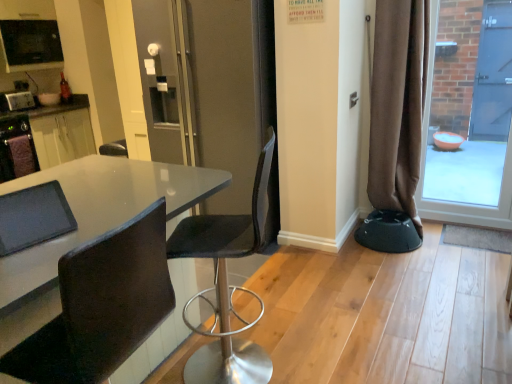
Question: Can you confirm if glossy white table at center is bigger than black plastic bar stool at lower right?

Choices:
 (A) yes
 (B) no

Answer: (A)

Question: Can you confirm if glossy white table at center is thinner than black plastic bar stool at lower right?

Choices:
 (A) yes
 (B) no

Answer: (B)

Question: Does glossy white table at center come behind black plastic bar stool at lower right?

Choices:
 (A) no
 (B) yes

Answer: (A)

Question: Is glossy white table at center smaller than black plastic bar stool at lower right?

Choices:
 (A) yes
 (B) no

Answer: (B)

Question: Can you confirm if glossy white table at center is shorter than black plastic bar stool at lower right?

Choices:
 (A) no
 (B) yes

Answer: (A)

Question: Does point (430, 213) appear closer or farther from the camera than point (203, 198)?

Choices:
 (A) farther
 (B) closer

Answer: (A)

Question: From the image's perspective, relative to glossy white table at center, is transparent glass door at right above or below?

Choices:
 (A) above
 (B) below

Answer: (A)

Question: From a real-world perspective, relative to glossy white table at center, is transparent glass door at right vertically above or below?

Choices:
 (A) below
 (B) above

Answer: (B)

Question: Is transparent glass door at right to the left or to the right of glossy white table at center in the image?

Choices:
 (A) left
 (B) right

Answer: (B)

Question: Considering the positions of black leather chair at lower left, arranged as the first chair when viewed from the front, and matte black table at left in the image, is black leather chair at lower left, arranged as the first chair when viewed from the front, wider or thinner than matte black table at left?

Choices:
 (A) wide
 (B) thin

Answer: (B)

Question: Is point (31, 362) positioned closer to the camera than point (22, 173)?

Choices:
 (A) farther
 (B) closer

Answer: (B)

Question: In the image, is black leather chair at lower left, the second chair viewed from the back, on the left side or the right side of matte black table at left?

Choices:
 (A) left
 (B) right

Answer: (B)

Question: In terms of height, does black leather chair at lower left, arranged as the first chair when viewed from the front, look taller or shorter compared to matte black table at left?

Choices:
 (A) short
 (B) tall

Answer: (B)

Question: Considering their positions, is matte black table at left located in front of or behind brushed metal toaster at left, which is the 1th appliance from bottom to top?

Choices:
 (A) front
 (B) behind

Answer: (A)

Question: From the image's perspective, relative to brushed metal toaster at left, positioned as the 2th appliance in top-to-bottom order, is matte black table at left above or below?

Choices:
 (A) below
 (B) above

Answer: (A)